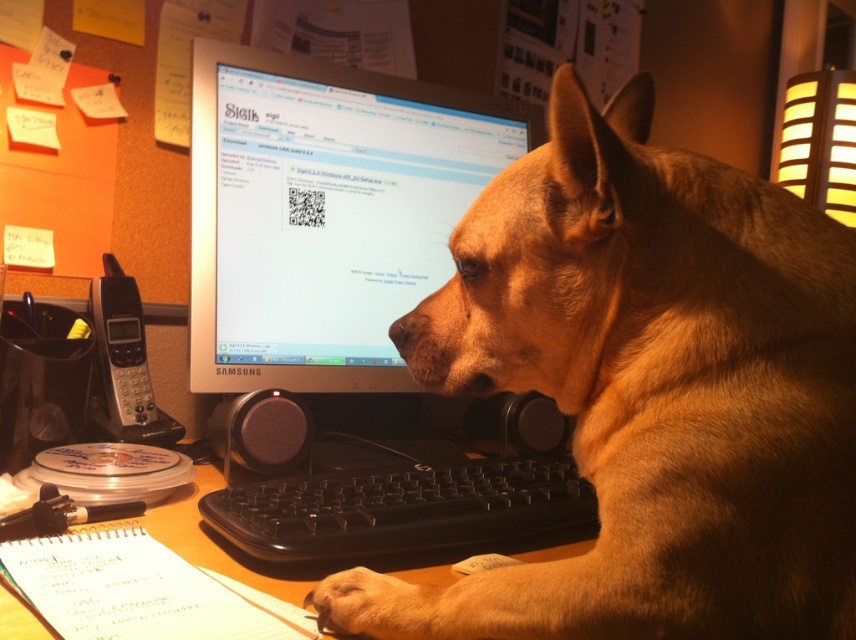
Does satin silver monitor at center have a larger size compared to wooden at lower left?

Indeed, satin silver monitor at center has a larger size compared to wooden at lower left.

Between satin silver monitor at center and wooden at lower left, which one is positioned lower?

wooden at lower left

Measure the distance between point (450, 205) and camera.

Point (450, 205) is 1.05 meters away from camera.

At what (x,y) coordinates should I click in order to perform the action: click on satin silver monitor at center. Please return your answer as a coordinate pair (x, y). Looking at the image, I should click on (324, 214).

Between black plastic keyboard at center and brown fur paw at lower center, which one has more height?

black plastic keyboard at center

Which of these two, black plastic keyboard at center or brown fur paw at lower center, stands shorter?

Standing shorter between the two is brown fur paw at lower center.

Image resolution: width=856 pixels, height=640 pixels. Describe the element at coordinates (400, 509) in the screenshot. I see `black plastic keyboard at center` at that location.

I want to click on black plastic keyboard at center, so click(x=400, y=509).

Between brown fur dog at center and wooden at lower left, which one has less height?

wooden at lower left is shorter.

Identify the location of brown fur dog at center. The height and width of the screenshot is (640, 856). (658, 381).